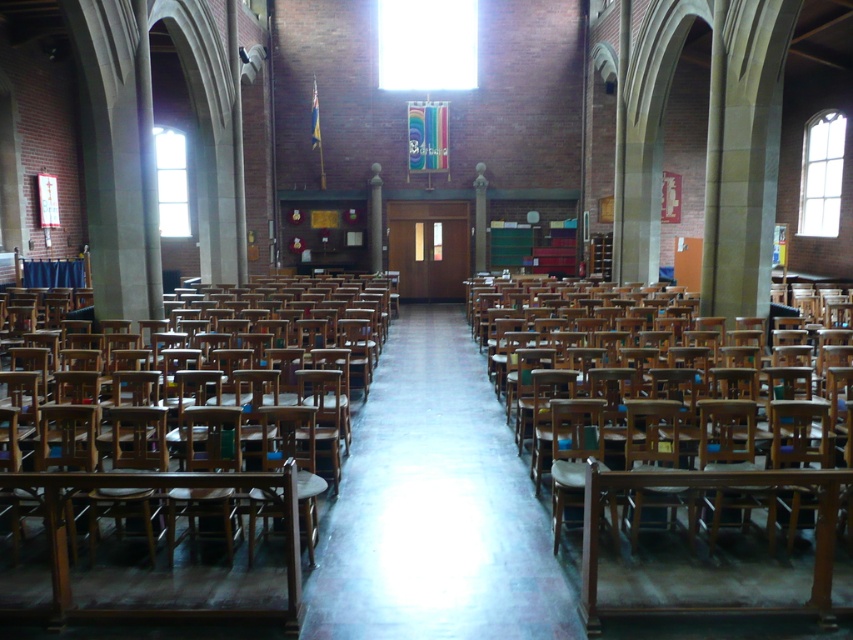
You are an event planner setting up for a presentation. You have two wooden items to place in the hall. The wooden at center and the wooden at right. Which one should you choose if you need a larger surface area for placing materials?

The wooden at center is bigger than wooden at right, so you should choose the wooden at center for a larger surface area.

You are organizing a small event in the hall and need to place a 2.5 meter wide table. You have two options for placement areas marked as wooden at center and wooden at right. Which area can accommodate the table without exceeding its width?

The wooden at center can accommodate the 2.5 meter wide table since its width surpasses that of the wooden at right.

You are standing in the hall and want to move from the wooden at center to the wooden at right. Which direction should you move in?

You should move to the right because wooden at center is to the left of wooden at right.